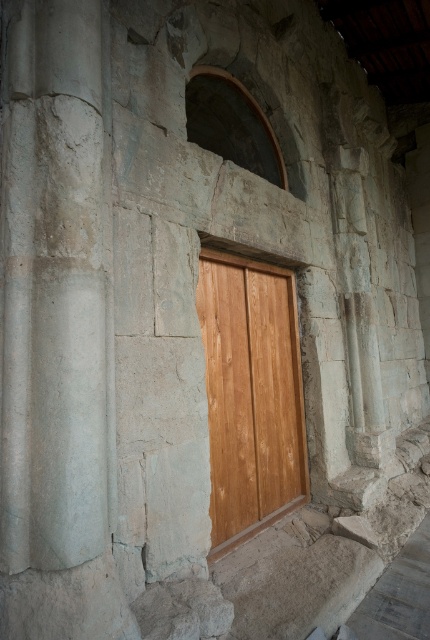
You are standing in front of the ancient stone structure and want to enter through the light brown wood door at center. To your left, there is a smooth concrete column at left. Which direction should you turn to face the door?

You should turn to your right to face the light brown wood door at center because the smooth concrete column at left is to the left of it.

You are an architect assessing the structural integrity of the ancient stone structure. You notice the smooth concrete column at left and the light brown wood door at center. Which object is taller?

The smooth concrete column at left is taller than the light brown wood door at center.